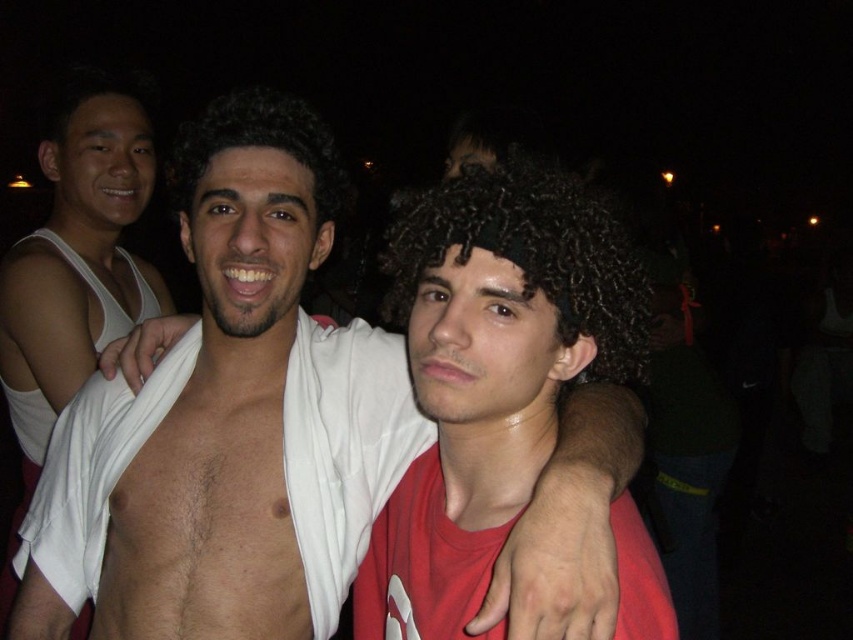
Question: Is curly dark brown hair at center behind dark curly hair at center?

Choices:
 (A) no
 (B) yes

Answer: (A)

Question: Which point is closer to the camera?

Choices:
 (A) (28, 464)
 (B) (596, 282)
 (C) (271, 144)
 (D) (274, 609)

Answer: (B)

Question: From the image, what is the correct spatial relationship of shiny white towel at center in relation to curly dark brown hair at center?

Choices:
 (A) above
 (B) below

Answer: (B)

Question: Does white tank top at left have a greater width compared to curly dark brown hair at center?

Choices:
 (A) yes
 (B) no

Answer: (B)

Question: Which point is farther to the camera?

Choices:
 (A) shiny white towel at center
 (B) dark curly hair at center

Answer: (B)

Question: Which of the following is the farthest from the observer?

Choices:
 (A) (480, 243)
 (B) (207, 330)
 (C) (190, 189)

Answer: (B)